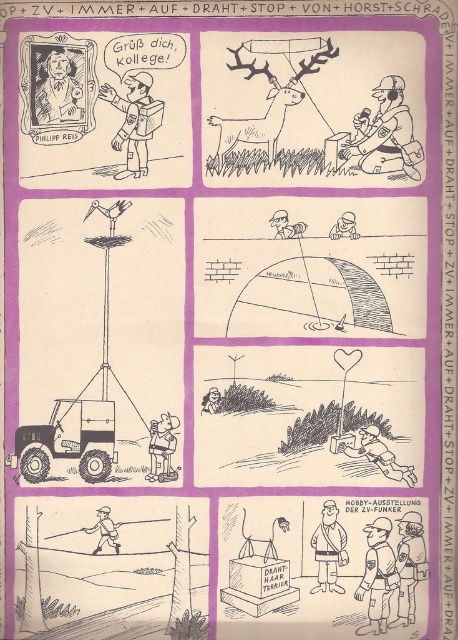
Question: Among these points, which one is nearest to the camera?

Choices:
 (A) (208, 116)
 (B) (424, 564)
 (C) (330, 508)
 (D) (381, 444)

Answer: (A)

Question: Does metallic helmet at lower center appear over smooth gray figure at center?

Choices:
 (A) yes
 (B) no

Answer: (B)

Question: Is brown textured reindeer at upper center positioned behind uniformed person at lower right?

Choices:
 (A) no
 (B) yes

Answer: (A)

Question: Can you confirm if brown textured reindeer at upper center is smaller than smooth plastic helmet at upper center?

Choices:
 (A) yes
 (B) no

Answer: (B)

Question: Among these points, which one is nearest to the camera?

Choices:
 (A) (414, 470)
 (B) (404, 145)
 (C) (359, 595)
 (D) (405, 515)

Answer: (C)

Question: Among these objects, which one is farthest from the camera?

Choices:
 (A) light brown uniform at lower right
 (B) smooth plastic helmet at upper center

Answer: (B)